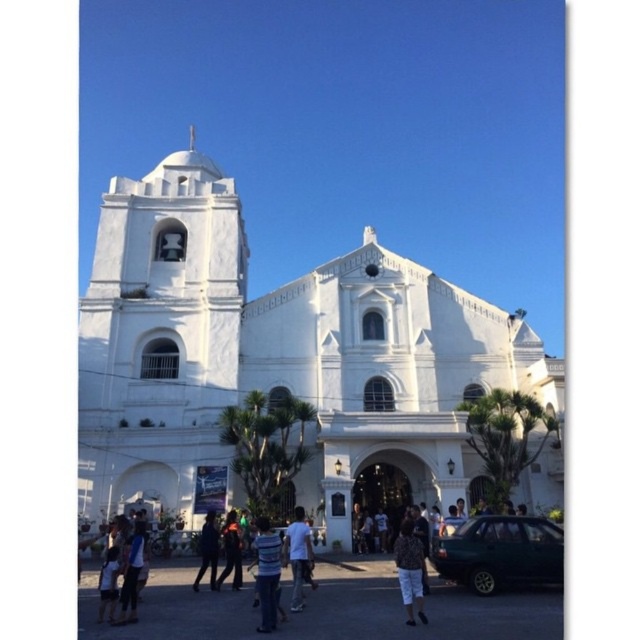
You are standing at the entrance of the church and want to find the printed fabric shorts at lower center. According to the coordinates provided, in which direction should you look to locate them?

The printed fabric shorts at lower center are located at coordinates point (410, 572) which means you should look towards the lower center direction to find them.

You are standing at the center of the image. Which direction should you move to get closer to the white smooth church at center?

Since the white smooth church at center is already at the center of the image, you are already facing it. There is no need to move in any direction to get closer.

You are standing in front of the church and see the printed fabric shorts at lower center and the white matte shirt at center. Which one is shorter in height?

The printed fabric shorts at lower center is not as tall as the white matte shirt at center, so the printed fabric shorts at lower center is shorter in height.